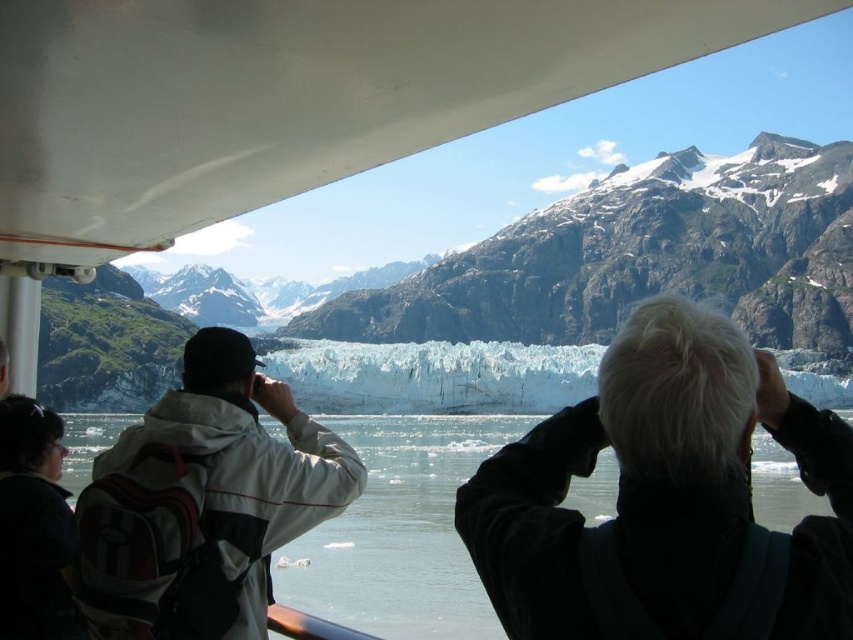
Question: Does white matte hair at upper right have a greater width compared to clear water at center?

Choices:
 (A) no
 (B) yes

Answer: (A)

Question: Which of these objects is positioned closest to the dark gray backpack at lower left?

Choices:
 (A) white matte jacket at center
 (B) clear water at center
 (C) white matte hair at upper right

Answer: (A)

Question: Estimate the real-world distances between objects in this image. Which object is closer to the clear water at center?

Choices:
 (A) dark gray backpack at lower left
 (B) white matte hair at upper right
 (C) white matte jacket at center

Answer: (C)

Question: Can you confirm if white matte hair at upper right is wider than clear water at center?

Choices:
 (A) no
 (B) yes

Answer: (A)

Question: In this image, where is white matte hair at upper right located relative to white matte jacket at center?

Choices:
 (A) left
 (B) right

Answer: (B)

Question: Which of these objects is positioned closest to the white matte hair at upper right?

Choices:
 (A) clear water at center
 (B) white matte jacket at center

Answer: (B)